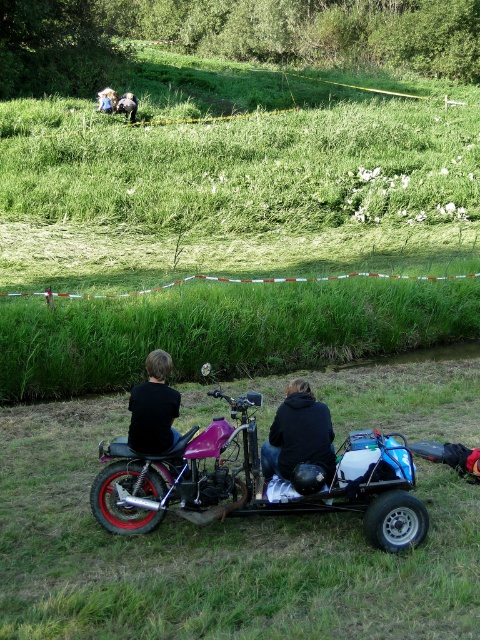
Describe the element at coordinates (299, 435) in the screenshot. This screenshot has height=640, width=480. I see `black matte jacket at center` at that location.

Is black matte jacket at center positioned behind fluffy white dog at upper center?

No.

Where is `black matte jacket at center`? This screenshot has height=640, width=480. black matte jacket at center is located at coordinates (299, 435).

Identify the location of black matte jacket at center. [x=299, y=435].

In the scene shown: Is green grass at lower center above black matte jacket at center?

Actually, green grass at lower center is below black matte jacket at center.

Looking at this image, between green grass at lower center and black matte jacket at center, which one is positioned higher?

black matte jacket at center

Between point (367, 570) and point (288, 429), which one is positioned in front?

Point (367, 570) is more forward.

You are a GUI agent. You are given a task and a screenshot of the screen. Output one action in this format:
    pyautogui.click(x=<x>, y=<y>)
    Task: Click on the green grass at lower center
    The width and height of the screenshot is (480, 640).
    Given the screenshot: What is the action you would take?
    pyautogui.click(x=213, y=556)

Who is taller, black matte jacket at center or black matte shirt at center?

With more height is black matte jacket at center.

Is black matte jacket at center shorter than black matte shirt at center?

In fact, black matte jacket at center may be taller than black matte shirt at center.

Is point (286, 461) positioned in front of point (131, 436)?

That is True.

Where is `black matte jacket at center`? This screenshot has width=480, height=640. black matte jacket at center is located at coordinates (299, 435).